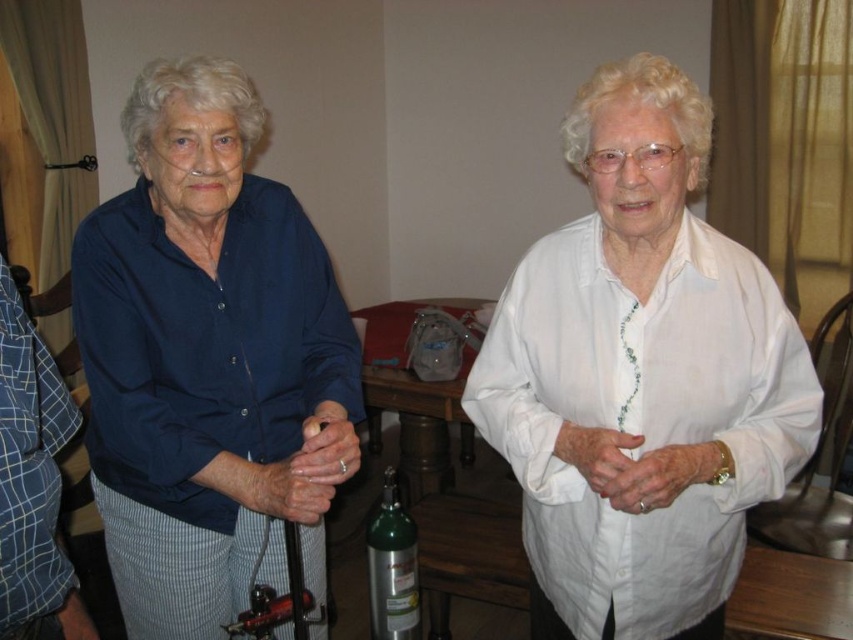
Question: Does white cotton shirt at upper right lie behind matte blue shirt at left?

Choices:
 (A) no
 (B) yes

Answer: (A)

Question: Does matte blue shirt at left come behind silver metallic oxygen tank at center?

Choices:
 (A) no
 (B) yes

Answer: (A)

Question: Where is white cotton shirt at upper right located in relation to matte blue shirt at left in the image?

Choices:
 (A) left
 (B) right

Answer: (B)

Question: Which point is closer to the camera taking this photo?

Choices:
 (A) (723, 416)
 (B) (167, 154)
 (C) (392, 636)

Answer: (A)

Question: Which of the following is the closest to the observer?

Choices:
 (A) matte blue shirt at left
 (B) silver metallic oxygen tank at center

Answer: (A)

Question: Among these objects, which one is farthest from the camera?

Choices:
 (A) silver metallic oxygen tank at center
 (B) white cotton shirt at upper right

Answer: (A)